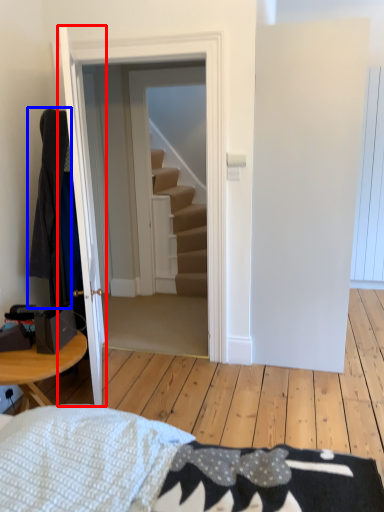
Question: Which object appears closest to the camera in this image, door (highlighted by a red box) or robe (highlighted by a blue box)?

Choices:
 (A) door
 (B) robe

Answer: (A)